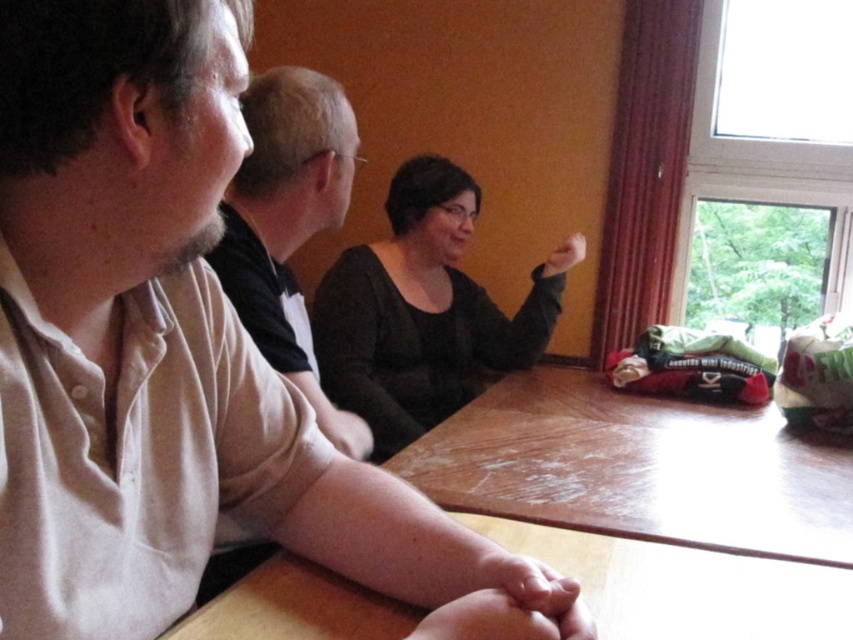
Question: Can you confirm if matte beige shirt at center is positioned below black matte shirt at center?

Choices:
 (A) no
 (B) yes

Answer: (B)

Question: Which point is farther to the camera?

Choices:
 (A) light beige shirt at left
 (B) matte beige shirt at center

Answer: (A)

Question: Which is nearer to the black matte shirt at center?

Choices:
 (A) matte beige shirt at center
 (B) light beige shirt at left

Answer: (B)

Question: Which is nearer to the matte beige shirt at center?

Choices:
 (A) light beige shirt at left
 (B) black matte shirt at center
 (C) wooden table at center

Answer: (C)

Question: Can you confirm if wooden table at center is bigger than light beige shirt at left?

Choices:
 (A) no
 (B) yes

Answer: (B)

Question: Is wooden table at center below light beige shirt at left?

Choices:
 (A) yes
 (B) no

Answer: (A)